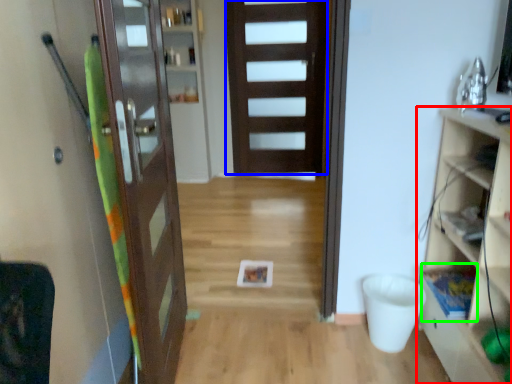
Question: Based on their relative distances, which object is nearer to cabinetry (highlighted by a red box)? Choose from door (highlighted by a blue box) and shelf (highlighted by a green box).

Choices:
 (A) door
 (B) shelf

Answer: (B)